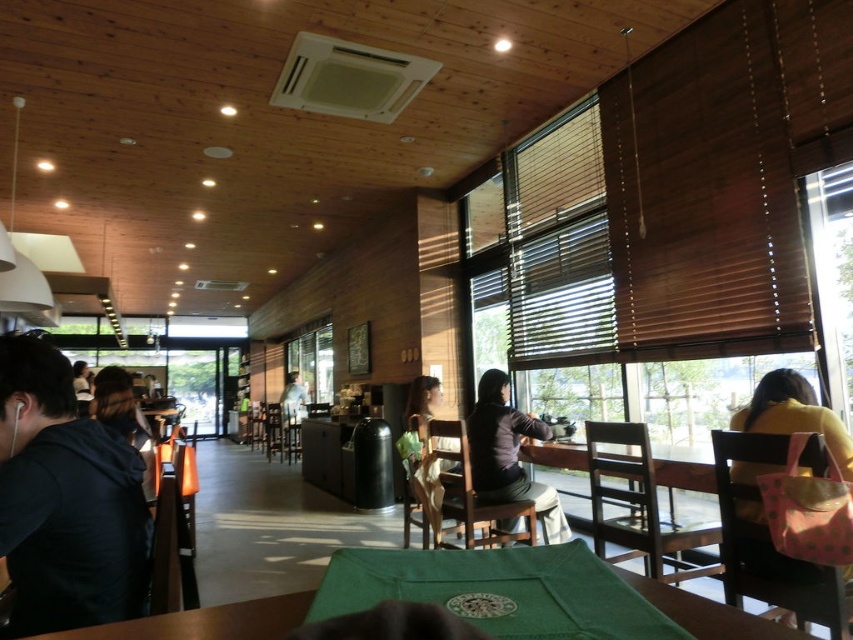
You are a barista at the counter and want to deliver a coffee to a customer wearing the black hoodie at left and another coffee to a customer wearing the yellow matte jacket at right. If you can carry both coffees at the same time, which customer should you approach first to minimize the total distance walked?

You should approach the customer wearing the black hoodie at left first because the black hoodie at left is closer to the counter than the yellow matte jacket at right, so delivering to them first minimizes the total distance walked.

You are a customer sitting at the table in the center of the cozy cafe. You notice two items on the table in front of you. One is a matte black shirt at center and the other is a yellow matte jacket at right. Which item is closer to the ground?

The matte black shirt at center is closer to the ground because it is positioned below the yellow matte jacket at right.